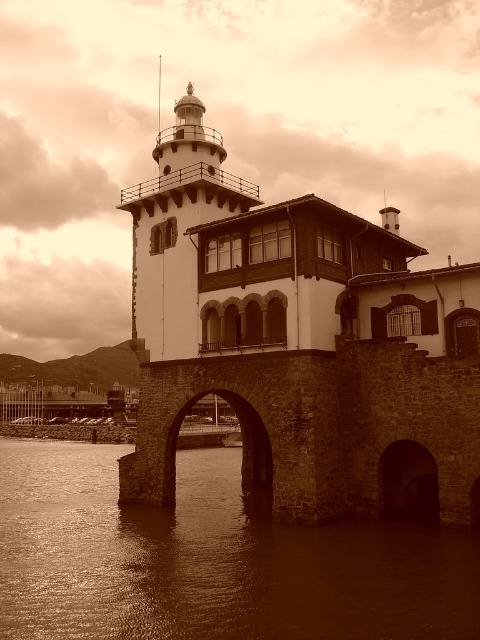
Is brown water at lower center bigger than white matte/lightweight tower at upper center?

Yes, brown water at lower center is bigger than white matte/lightweight tower at upper center.

Is the position of brown water at lower center more distant than that of white matte/lightweight tower at upper center?

That is False.

Is point (359, 634) positioned before point (140, 276)?

Yes.

The height and width of the screenshot is (640, 480). In order to click on brown water at lower center in this screenshot , I will do `click(211, 560)`.